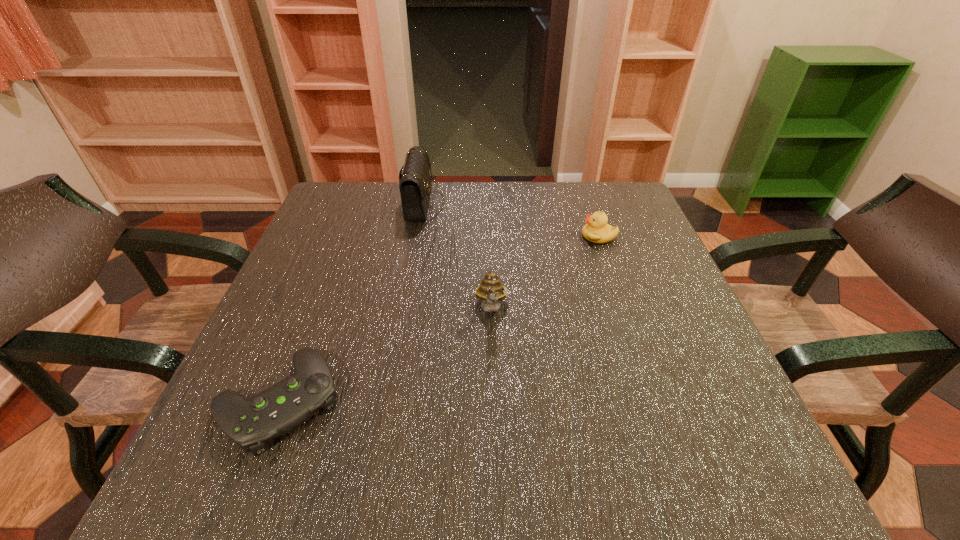
Where is `free space between the second nearest object and the farthest object`? The height and width of the screenshot is (540, 960). free space between the second nearest object and the farthest object is located at coordinates click(458, 256).

What are the coordinates of `free space that is in between the farthest object and the control` in the screenshot? It's located at (351, 302).

You are a GUI agent. You are given a task and a screenshot of the screen. Output one action in this format:
    pyautogui.click(x=<x>, y=<y>)
    Task: Click on the vacant area that lies between the farthest object and the second shortest object
    The width and height of the screenshot is (960, 540).
    Given the screenshot: What is the action you would take?
    pyautogui.click(x=511, y=219)

This screenshot has height=540, width=960. I want to click on free space between the shortest object and the third object from right to left, so click(x=351, y=302).

Find the location of a particular element. This screenshot has width=960, height=540. free spot between the shortest object and the snail is located at coordinates coord(386,355).

Find the location of a particular element. Image resolution: width=960 pixels, height=540 pixels. unoccupied area between the second farthest object and the farthest object is located at coordinates (511, 219).

Locate an element on the screen. The height and width of the screenshot is (540, 960). vacant space that is in between the second object from left to right and the shortest object is located at coordinates [351, 302].

At what (x,y) coordinates should I click in order to perform the action: click on unoccupied area between the clutch bag and the second nearest object. Please return your answer as a coordinate pair (x, y). Image resolution: width=960 pixels, height=540 pixels. Looking at the image, I should click on (458, 256).

Locate which object is the closest to the control. Please provide its 2D coordinates. Your answer should be formatted as a tuple, i.e. [(x, y)], where the tuple contains the x and y coordinates of a point satisfying the conditions above.

[(490, 290)]

Where is `object that is the second nearest to the nearest object`? The height and width of the screenshot is (540, 960). object that is the second nearest to the nearest object is located at coordinates click(x=415, y=184).